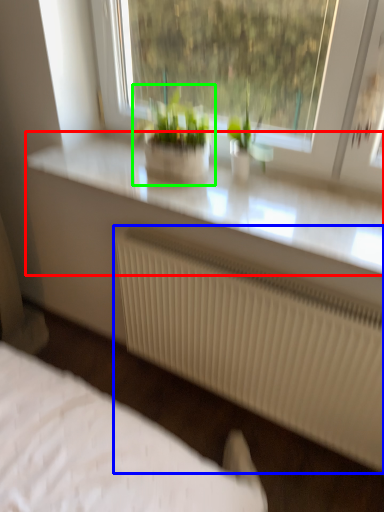
Question: Which object is positioned closest to counter top (highlighted by a red box)? Select from radiator (highlighted by a blue box) and houseplant (highlighted by a green box).

Choices:
 (A) radiator
 (B) houseplant

Answer: (B)